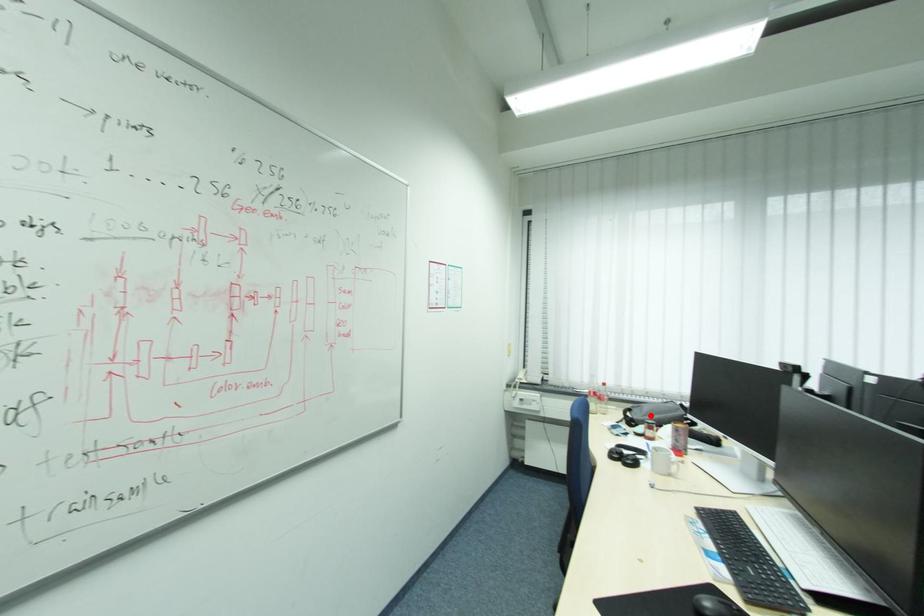
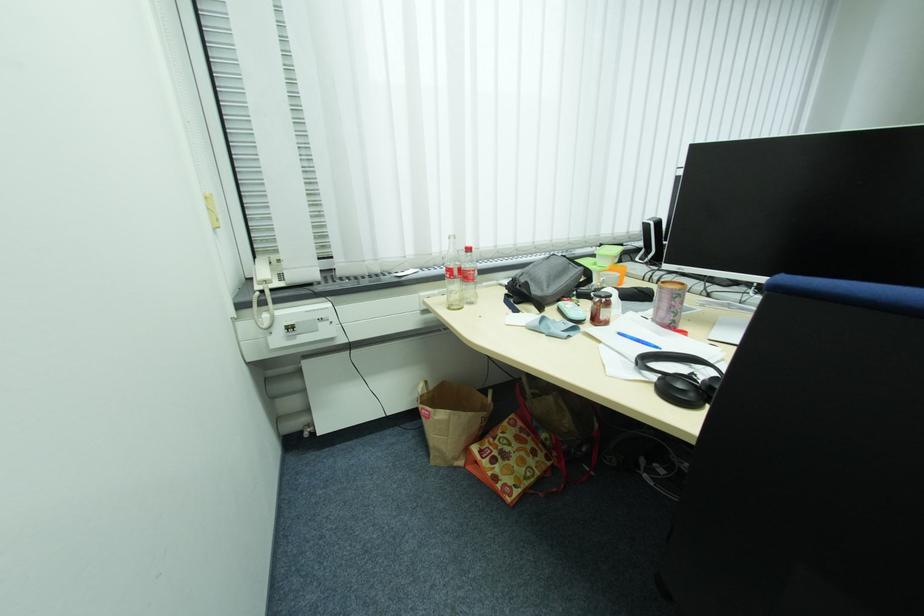
The point at the highlighted location is marked in the first image. Where is the corresponding point in the second image?

(554, 286)